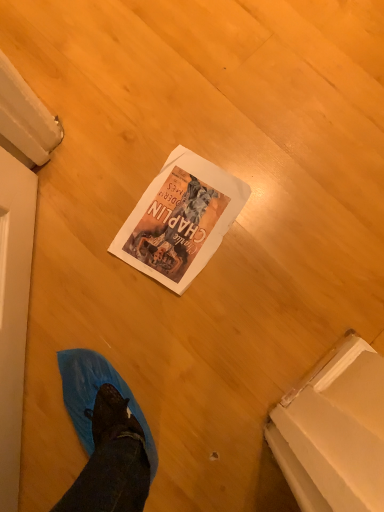
The image size is (384, 512). I want to click on empty space that is ontop of white paper comic book at center (from a real-world perspective), so click(184, 215).